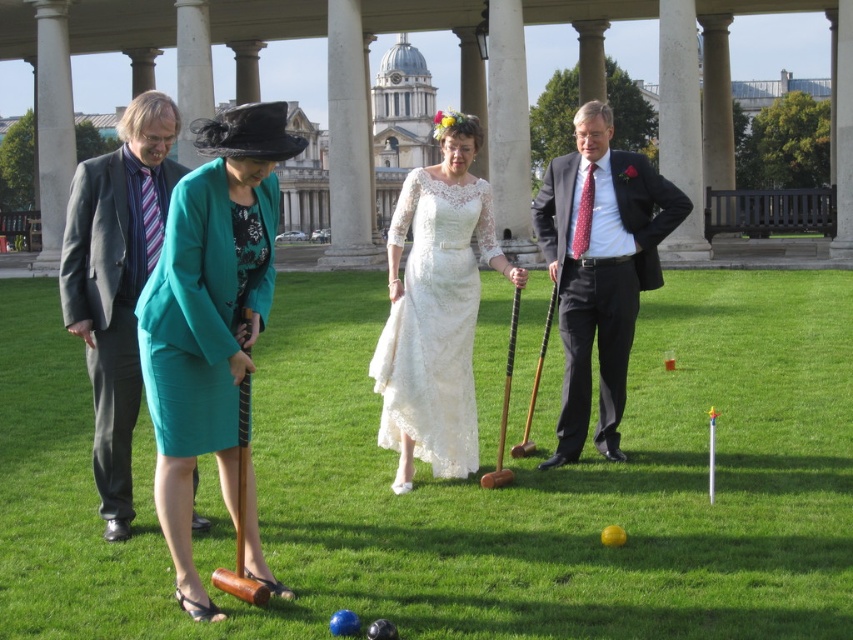
Question: Does wooden croquet mallets at center have a greater width compared to teal fabric skirt at lower left?

Choices:
 (A) yes
 (B) no

Answer: (A)

Question: Which object is the closest to the wooden croquet mallets at center?

Choices:
 (A) teal fabric dress at center
 (B) lace/embroidered dress at center
 (C) gray suit at left
 (D) teal fabric skirt at lower left

Answer: (B)

Question: Does dark gray suit at right have a greater width compared to teal fabric dress at center?

Choices:
 (A) yes
 (B) no

Answer: (A)

Question: Which object appears closest to the camera in this image?

Choices:
 (A) lace/embroidered dress at center
 (B) dark gray suit at right
 (C) teal fabric skirt at lower left
 (D) gray suit at left

Answer: (C)

Question: Which of the following is the farthest from the observer?

Choices:
 (A) wooden croquet mallets at center
 (B) gray suit at left
 (C) dark gray suit at right

Answer: (C)

Question: Is wooden croquet mallets at center closer to the viewer compared to gray suit at left?

Choices:
 (A) no
 (B) yes

Answer: (B)